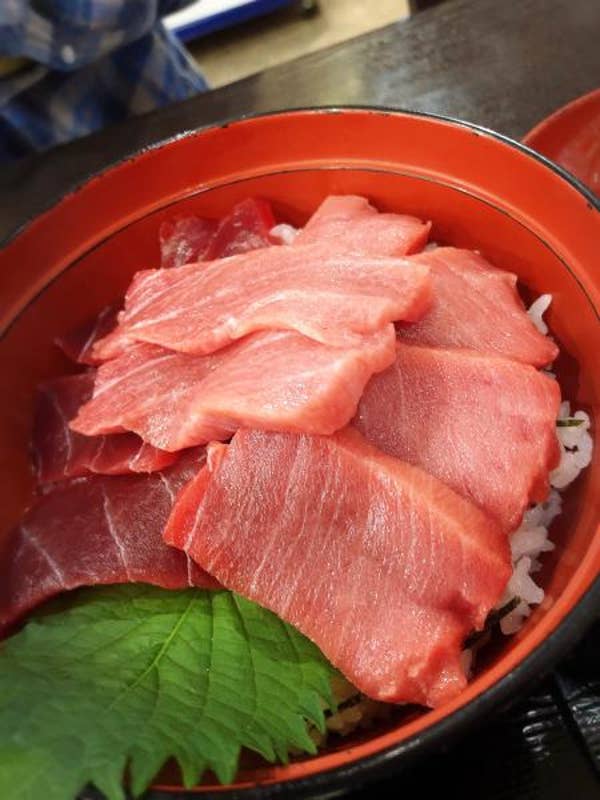
Find the location of a particular element. This screenshot has width=600, height=800. box is located at coordinates (266, 40).